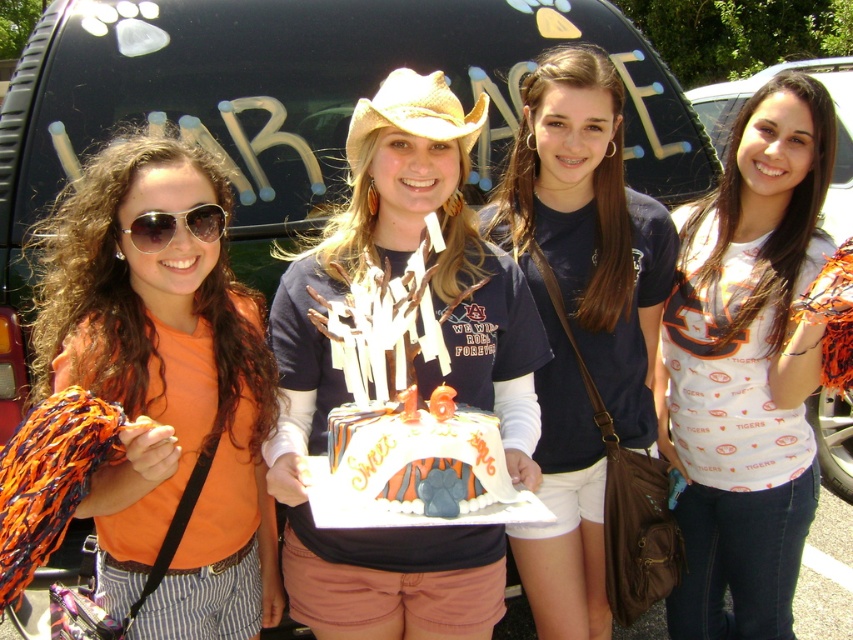
Question: Is matte black shirt at center wider than white fondant cake at center?

Choices:
 (A) yes
 (B) no

Answer: (A)

Question: Among these points, which one is nearest to the camera?

Choices:
 (A) (628, 209)
 (B) (131, 234)
 (C) (387, 81)
 (D) (155, 198)

Answer: (D)

Question: Does matte navy t-shirt at center appear on the right side of strawhat at center?

Choices:
 (A) no
 (B) yes

Answer: (B)

Question: Which point is farther to the camera?

Choices:
 (A) (276, 340)
 (B) (755, 344)
 (C) (190, 429)

Answer: (B)

Question: Is white printed shirt at center below white fondant cake at center?

Choices:
 (A) no
 (B) yes

Answer: (A)

Question: Which object is farther from the camera taking this photo?

Choices:
 (A) orange fabric pom-pom at left
 (B) white fondant cake at center
 (C) white printed shirt at center
 (D) matte black sunglasses at left

Answer: (C)